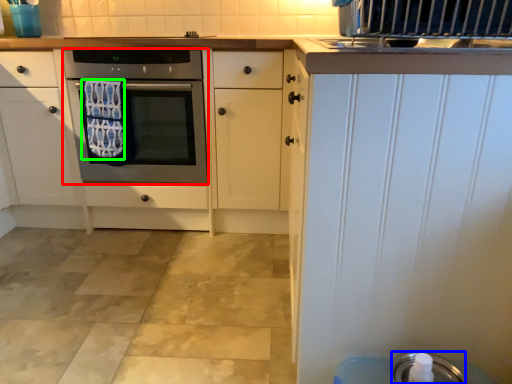
Question: Which object is positioned farthest from oven (highlighted by a red box)? Select from appliance (highlighted by a blue box) and bath towel (highlighted by a green box).

Choices:
 (A) appliance
 (B) bath towel

Answer: (A)